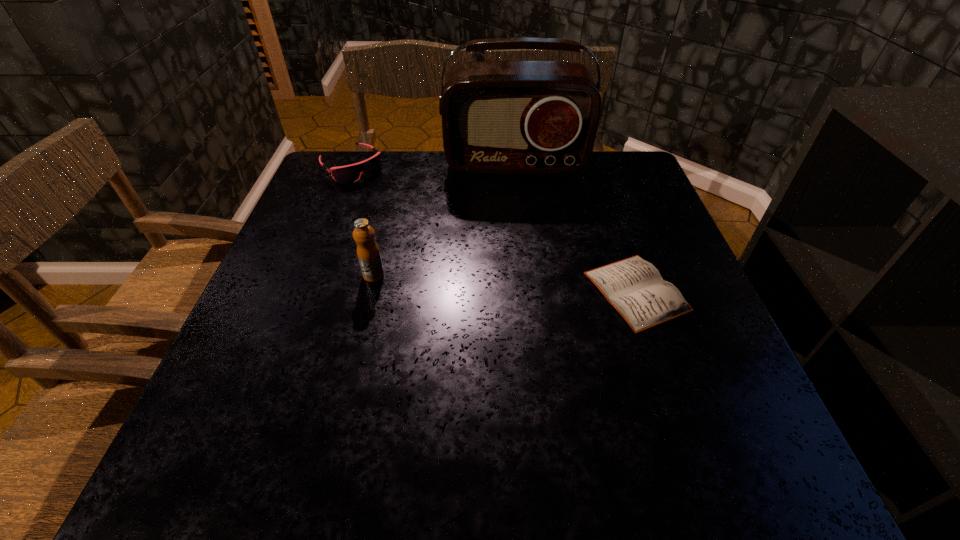
In order to click on vacant space positioned on the front panel of the radio receiver in this screenshot , I will do `click(525, 276)`.

Where is `vacant space located on the front-facing side of the leftmost object`? vacant space located on the front-facing side of the leftmost object is located at coordinates (409, 222).

The image size is (960, 540). I want to click on vacant region located 0.210m on the front-facing side of the leftmost object, so click(404, 218).

Where is `free space located on the front-facing side of the leftmost object`? The height and width of the screenshot is (540, 960). free space located on the front-facing side of the leftmost object is located at coordinates (421, 235).

At what (x,y) coordinates should I click in order to perform the action: click on radio receiver that is positioned at the far edge. Please return your answer as a coordinate pair (x, y). The width and height of the screenshot is (960, 540). Looking at the image, I should click on [x=498, y=117].

Find the location of a particular element. Image resolution: width=960 pixels, height=540 pixels. goggles present at the far edge is located at coordinates (351, 173).

Where is `object that is at the left edge`? object that is at the left edge is located at coordinates (351, 173).

This screenshot has width=960, height=540. I want to click on diary present at the right edge, so click(634, 287).

Find the location of a particular element. The image size is (960, 540). radio receiver that is at the right edge is located at coordinates (498, 117).

At what (x,y) coordinates should I click in order to perform the action: click on object located in the far left corner section of the desktop. Please return your answer as a coordinate pair (x, y). Image resolution: width=960 pixels, height=540 pixels. Looking at the image, I should click on (351, 173).